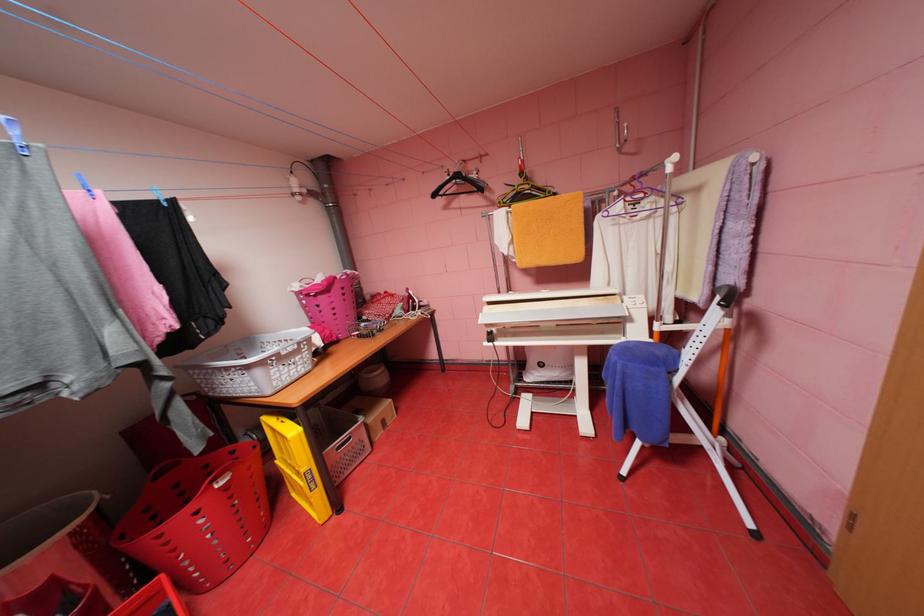
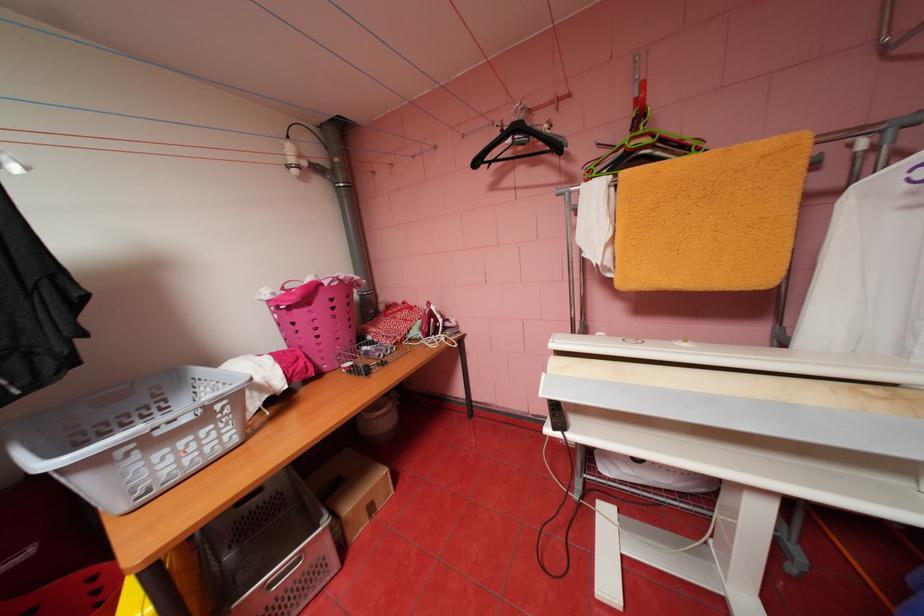
The point at (x=443, y=195) is marked in the first image. Where is the corresponding point in the second image?

(484, 163)